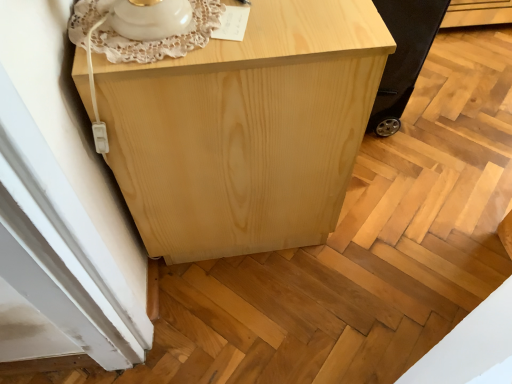
Question: Considering the relative sizes of black rubber wheel at lower right and natural wood cabinet at center in the image provided, is black rubber wheel at lower right bigger than natural wood cabinet at center?

Choices:
 (A) yes
 (B) no

Answer: (B)

Question: Is the position of black rubber wheel at lower right less distant than that of natural wood cabinet at center?

Choices:
 (A) no
 (B) yes

Answer: (A)

Question: Does black rubber wheel at lower right have a smaller size compared to natural wood cabinet at center?

Choices:
 (A) yes
 (B) no

Answer: (A)

Question: Is natural wood cabinet at center surrounded by black rubber wheel at lower right?

Choices:
 (A) no
 (B) yes

Answer: (A)

Question: From the image's perspective, is black rubber wheel at lower right below natural wood cabinet at center?

Choices:
 (A) yes
 (B) no

Answer: (B)

Question: Is black rubber wheel at lower right oriented away from natural wood cabinet at center?

Choices:
 (A) yes
 (B) no

Answer: (A)

Question: Considering the relative sizes of natural wood cabinet at center and black rubber wheel at lower right in the image provided, is natural wood cabinet at center shorter than black rubber wheel at lower right?

Choices:
 (A) yes
 (B) no

Answer: (B)

Question: Can you confirm if natural wood cabinet at center is positioned to the right of black rubber wheel at lower right?

Choices:
 (A) yes
 (B) no

Answer: (B)

Question: From a real-world perspective, is natural wood cabinet at center located higher than black rubber wheel at lower right?

Choices:
 (A) yes
 (B) no

Answer: (A)

Question: Is natural wood cabinet at center directly adjacent to black rubber wheel at lower right?

Choices:
 (A) no
 (B) yes

Answer: (A)

Question: Does natural wood cabinet at center lie in front of black rubber wheel at lower right?

Choices:
 (A) yes
 (B) no

Answer: (A)

Question: Would you say black rubber wheel at lower right is part of natural wood cabinet at center's contents?

Choices:
 (A) no
 (B) yes

Answer: (A)

Question: Is natural wood cabinet at center to the left or to the right of black rubber wheel at lower right in the image?

Choices:
 (A) left
 (B) right

Answer: (A)